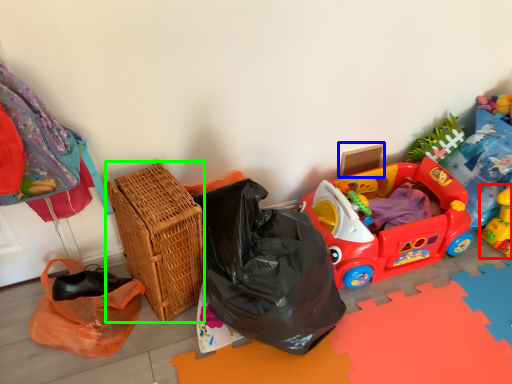
Question: Considering the real-world distances, which object is closest to toy (highlighted by a red box)? cardboard box (highlighted by a blue box) or basket (highlighted by a green box).

Choices:
 (A) cardboard box
 (B) basket

Answer: (A)